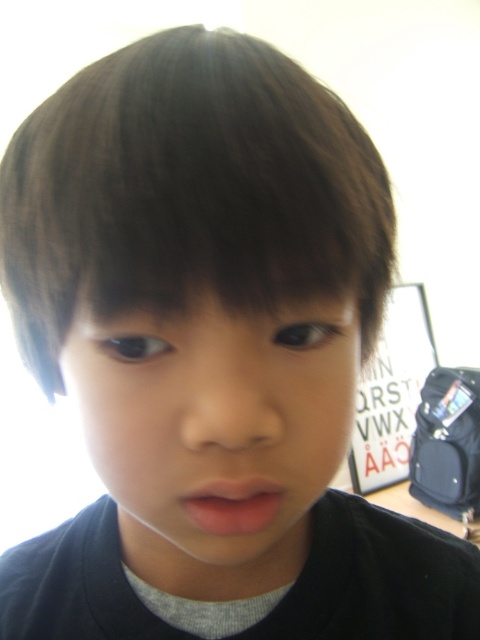
Question: Is smooth skin face at center bigger than pink matte lips at center?

Choices:
 (A) no
 (B) yes

Answer: (B)

Question: Can you confirm if smooth skin face at center is thinner than pink matte lips at center?

Choices:
 (A) yes
 (B) no

Answer: (B)

Question: Among these points, which one is farthest from the camera?

Choices:
 (A) (210, 508)
 (B) (191, 394)

Answer: (A)

Question: In this image, where is smooth skin face at center located relative to pink matte lips at center?

Choices:
 (A) left
 (B) right

Answer: (A)

Question: Which object appears farthest from the camera in this image?

Choices:
 (A) smooth skin face at center
 (B) pink matte lips at center

Answer: (B)